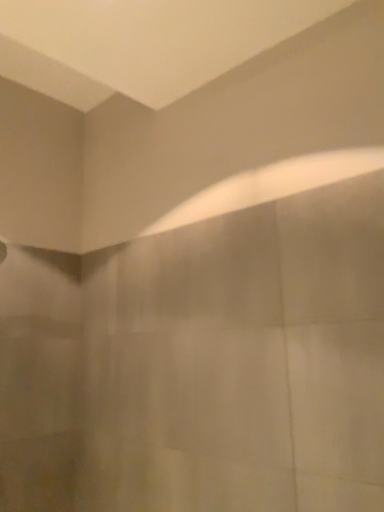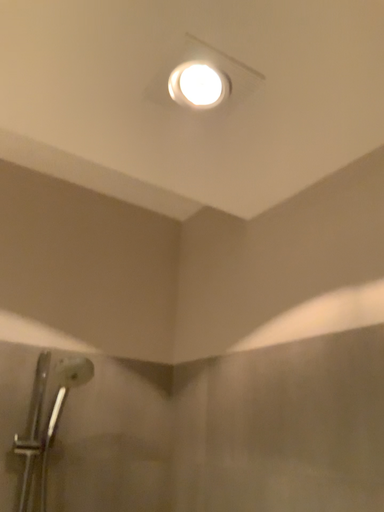
Question: Which way did the camera rotate in the video?

Choices:
 (A) rotated right
 (B) rotated left

Answer: (B)